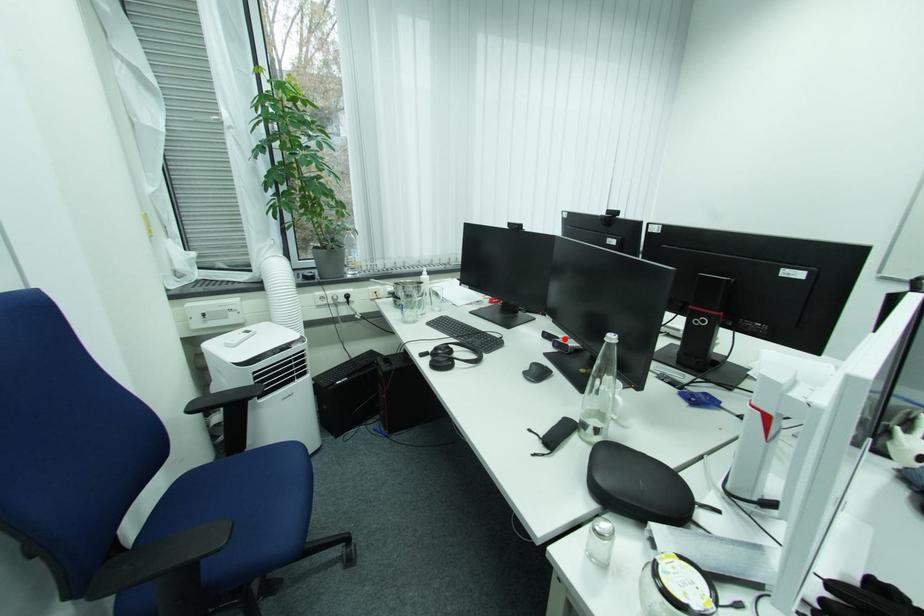
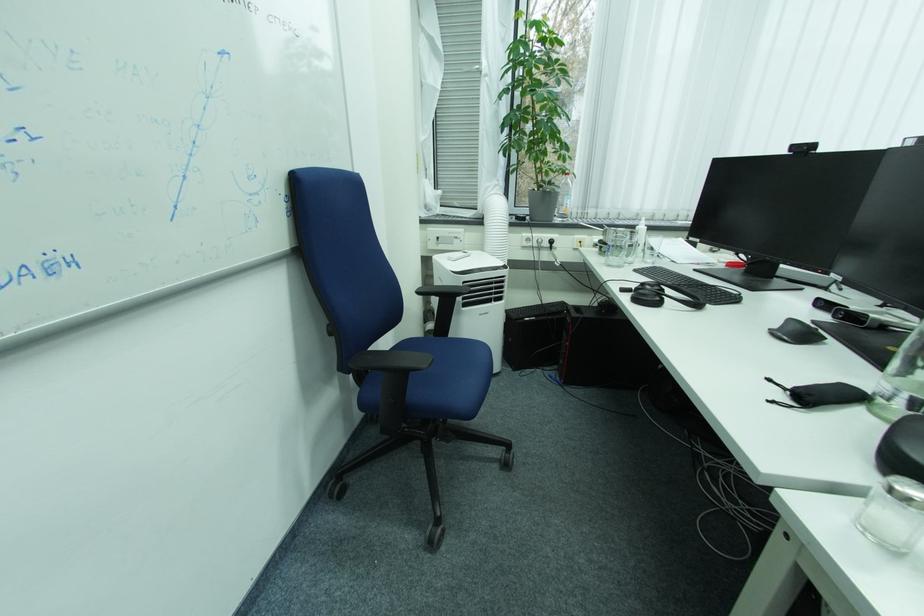
Question: A red point is marked in image1. In image2, is the corresponding 3D point closer to the camera or farther? Reply with the corresponding letter.

Choices:
 (A) The corresponding 3D point is closer.
 (B) The corresponding 3D point is farther.

Answer: (B)